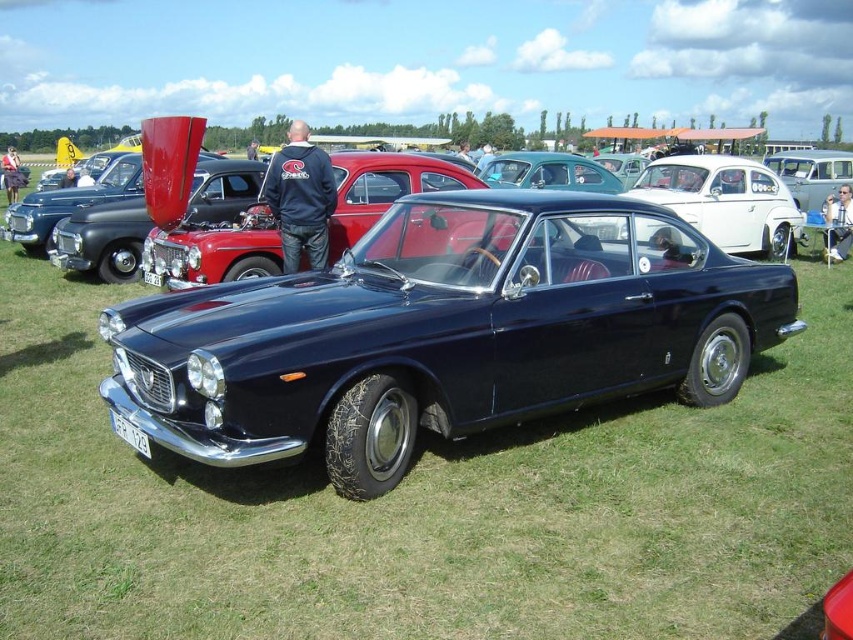
Can you confirm if black fabric jacket at center is thinner than white plastic license plate at center?

No, black fabric jacket at center is not thinner than white plastic license plate at center.

Is black fabric jacket at center to the left of white plastic license plate at center from the viewer's perspective?

In fact, black fabric jacket at center is to the right of white plastic license plate at center.

Who is more distant from viewer, (305,221) or (158,275)?

The point (158,275) is more distant.

This screenshot has width=853, height=640. What are the coordinates of `black fabric jacket at center` in the screenshot? It's located at (300, 198).

Between dark blue leather jacket at center and white plastic license plate at center, which one is positioned lower?

white plastic license plate at center

Does point (10, 163) lie in front of point (152, 280)?

No, it is behind (152, 280).

I want to click on dark blue leather jacket at center, so click(10, 173).

Can you confirm if black fabric jacket at center is taller than black plastic license plate at center?

Yes.

Can you confirm if black fabric jacket at center is bigger than black plastic license plate at center?

Yes.

Is point (312, 209) farther from camera compared to point (125, 435)?

Yes, it is.

Where is `black fabric jacket at center`? The image size is (853, 640). black fabric jacket at center is located at coordinates (300, 198).